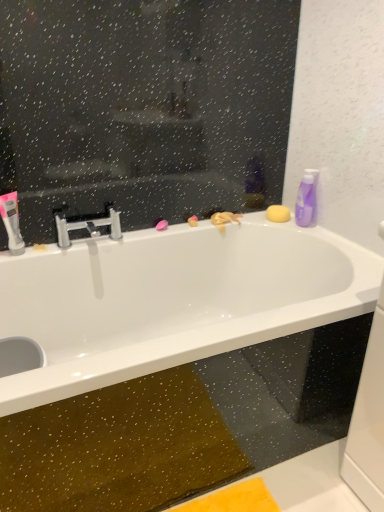
Question: Choose the correct answer: Is purple glossy bottle at upper right inside white glossy toothpaste at left or outside it?

Choices:
 (A) inside
 (B) outside

Answer: (B)

Question: From a real-world perspective, is purple glossy bottle at upper right positioned above or below white glossy toothpaste at left?

Choices:
 (A) below
 (B) above

Answer: (B)

Question: Based on their relative distances, which object is farther from the white glossy toothpaste at left?

Choices:
 (A) purple glossy bottle at upper right
 (B) polished chrome faucet at center
 (C) white glossy bathtub at upper center

Answer: (A)

Question: Based on their relative distances, which object is nearer to the white glossy bathtub at upper center?

Choices:
 (A) polished chrome faucet at center
 (B) white glossy toothpaste at left
 (C) purple glossy bottle at upper right

Answer: (A)